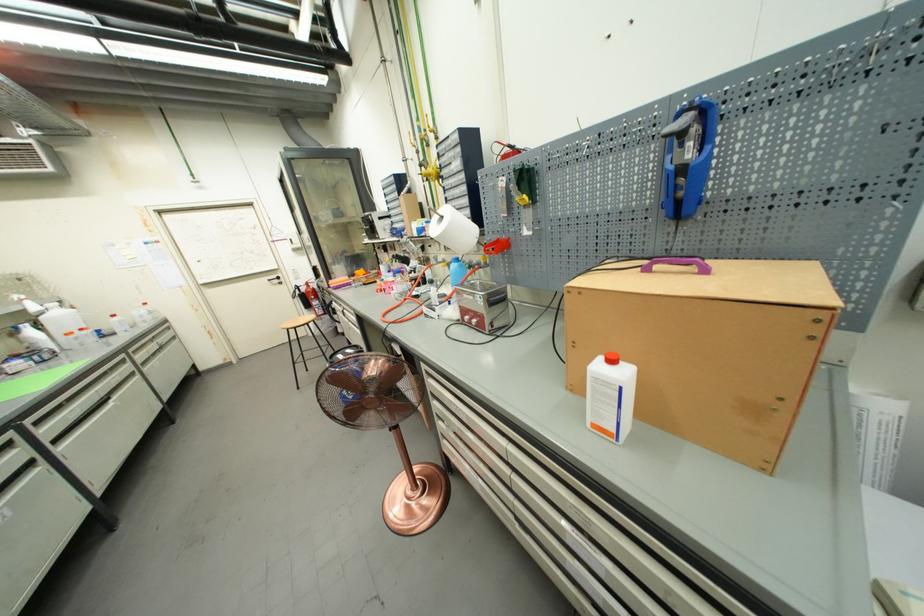
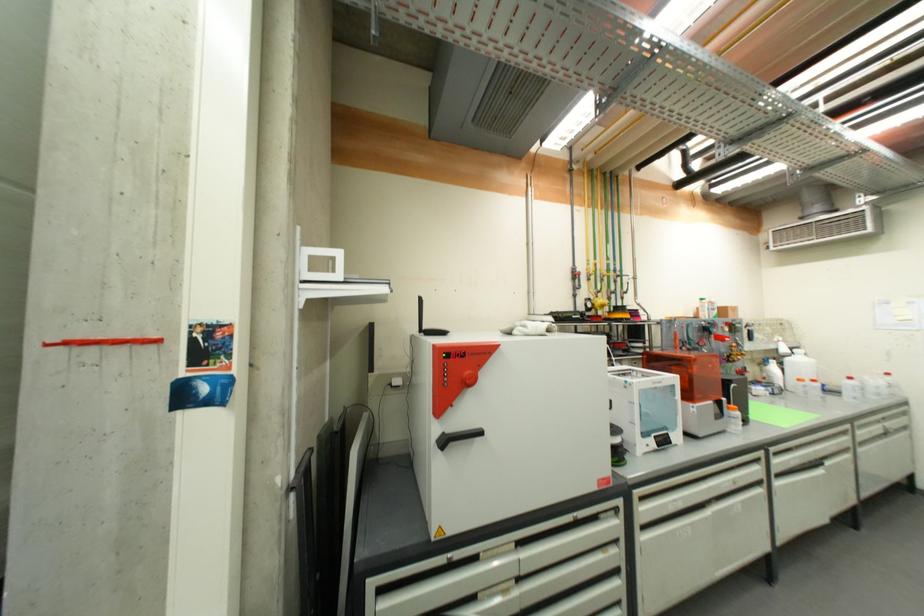
Locate, in the second image, the point that corresponds to (x=52, y=440) in the first image.

(779, 472)